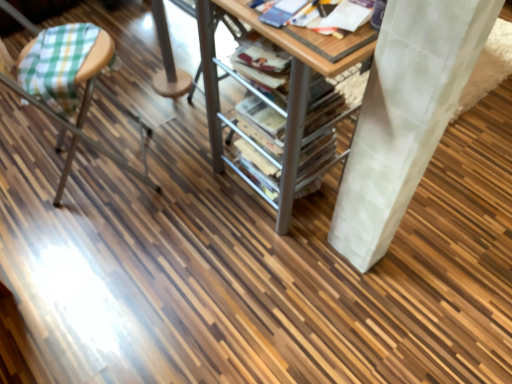
Identify the location of vacant area that is in front of green plaid fabric stool at left. (87, 250).